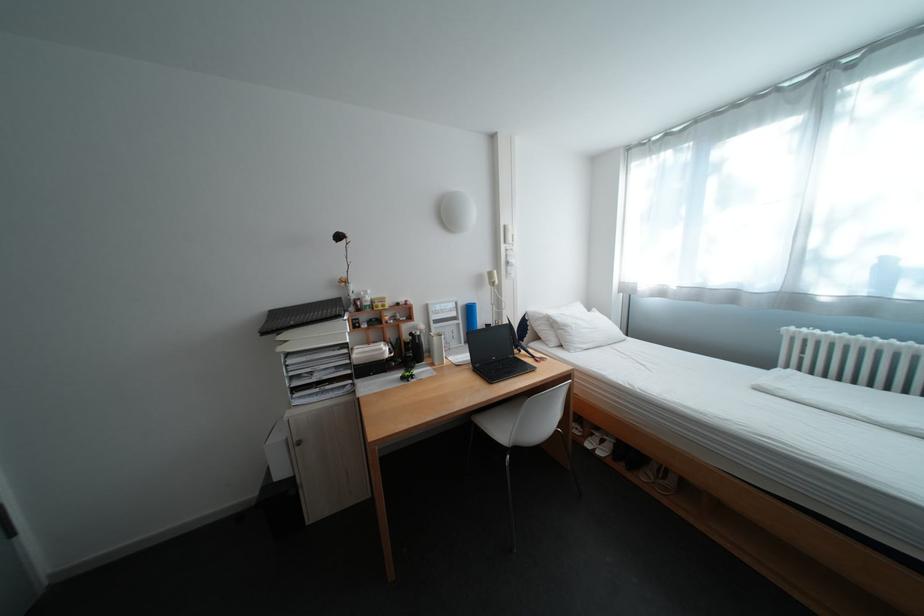
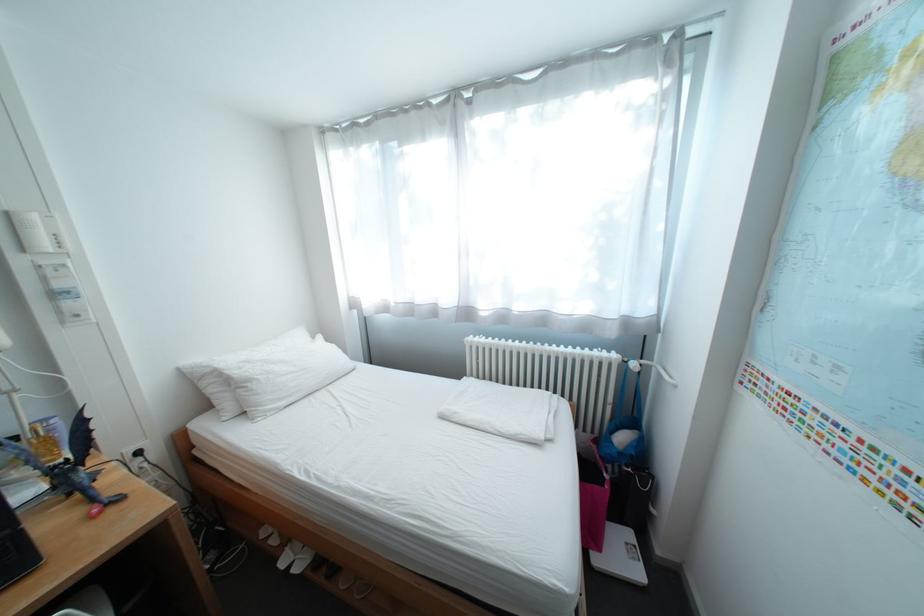
Locate, in the second image, the point that corresponds to the point at 532,352 in the first image.

(81, 495)